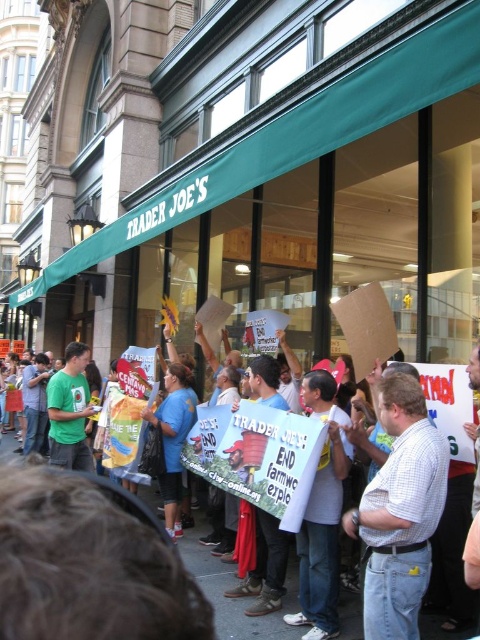
Question: In this image, where is white checkered shirt at center located relative to blue t-shirt at center?

Choices:
 (A) left
 (B) right

Answer: (B)

Question: Is white checkered shirt at center thinner than blue t-shirt at center?

Choices:
 (A) no
 (B) yes

Answer: (B)

Question: Among these points, which one is nearest to the camera?

Choices:
 (A) (345, 611)
 (B) (382, 518)

Answer: (B)

Question: From the image, what is the correct spatial relationship of white checkered shirt at center in relation to blue t-shirt at center?

Choices:
 (A) above
 (B) below

Answer: (A)

Question: Among these objects, which one is nearest to the camera?

Choices:
 (A) white checkered shirt at center
 (B) blue t-shirt at center

Answer: (A)